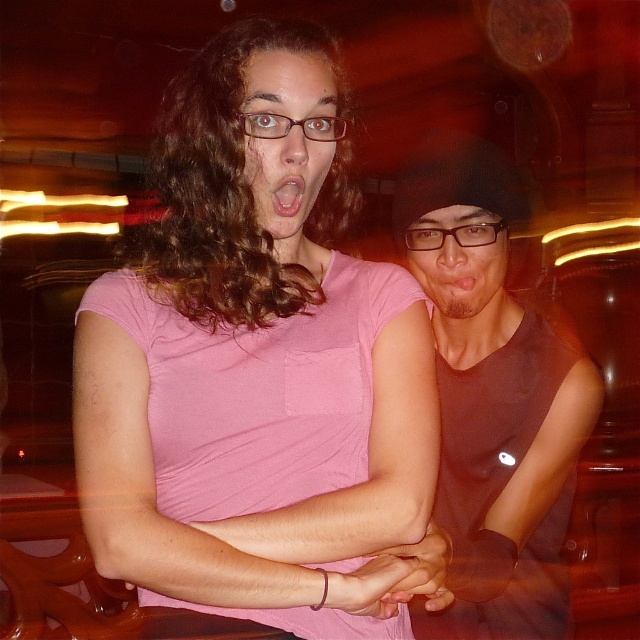
Is pink matte shirt at center to the left of matte pink shirt at center from the viewer's perspective?

Yes, pink matte shirt at center is to the left of matte pink shirt at center.

Can you confirm if pink matte shirt at center is positioned below matte pink shirt at center?

Indeed, pink matte shirt at center is positioned under matte pink shirt at center.

Who is more forward, [305,321] or [285,154]?

Point [285,154] is more forward.

Find the location of a particular element. This screenshot has width=640, height=640. pink matte shirt at center is located at coordinates (257, 365).

Is point (333, 300) closer to camera compared to point (282, 214)?

No, (333, 300) is behind (282, 214).

Between pink matte shirt at center and pink matte mouth at center, which one has less height?

Standing shorter between the two is pink matte mouth at center.

Is point (339, 106) farther from viewer compared to point (285, 182)?

That is True.

Locate an element on the screen. pink matte shirt at center is located at coordinates (257, 365).

Does matte black tank top at center appear over matte pink shirt at center?

A: Actually, matte black tank top at center is below matte pink shirt at center.

Does point (408, 262) lie behind point (289, 51)?

Yes, it is behind point (289, 51).

Which is behind, point (454, 172) or point (257, 100)?

Positioned behind is point (454, 172).

I want to click on matte black tank top at center, so click(493, 401).